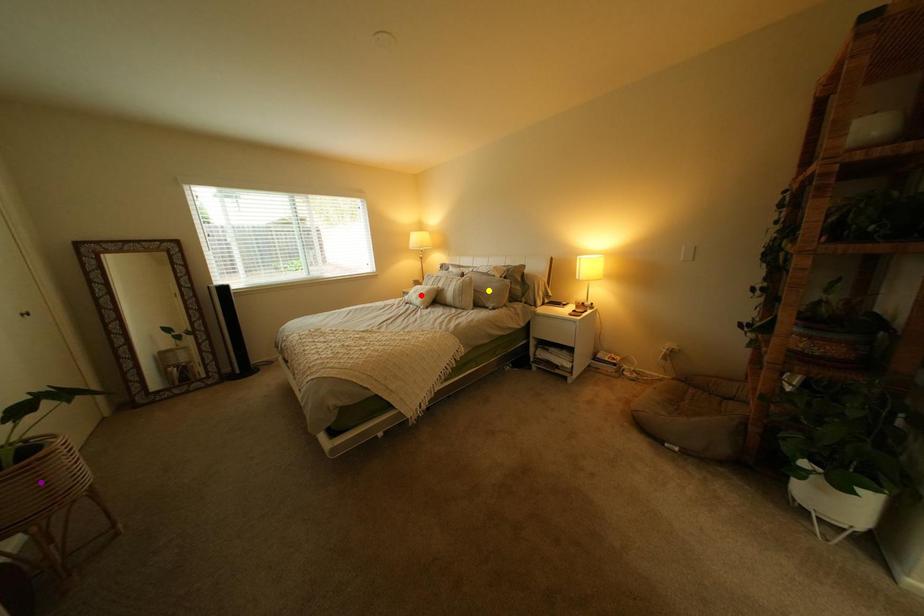
Order these from nearest to farthest:
yellow point | purple point | red point

purple point, yellow point, red point